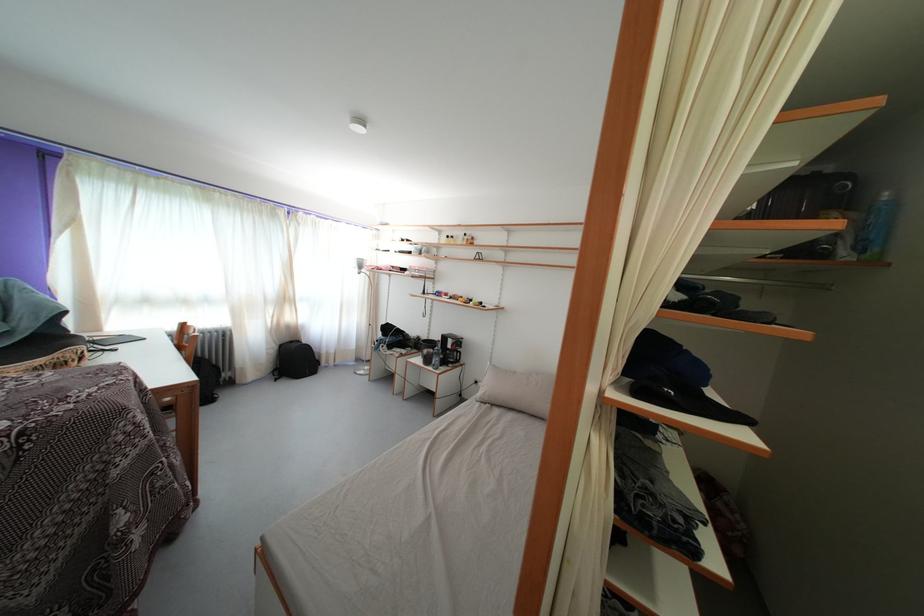
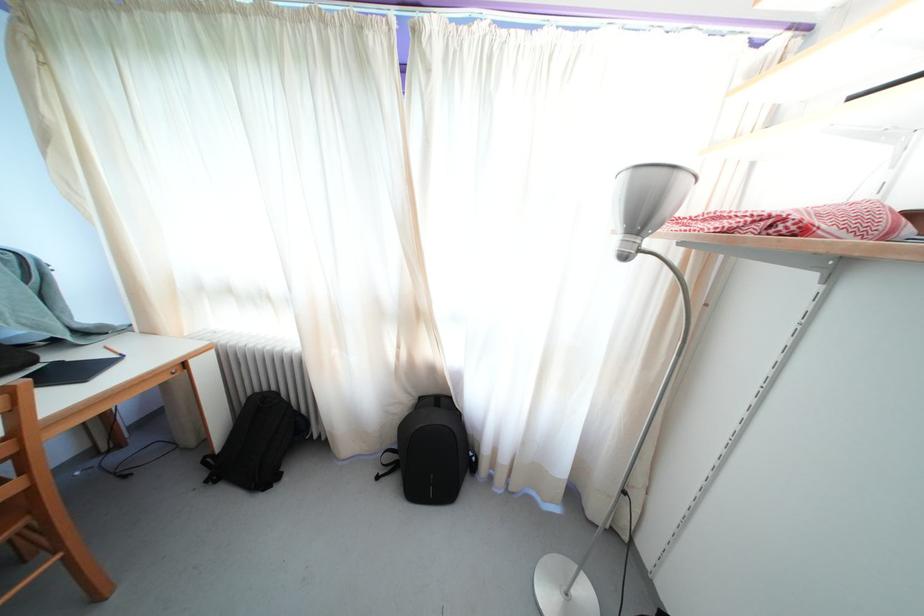
In the second image, find the point that corresponds to point (292, 305) in the first image.

(421, 321)